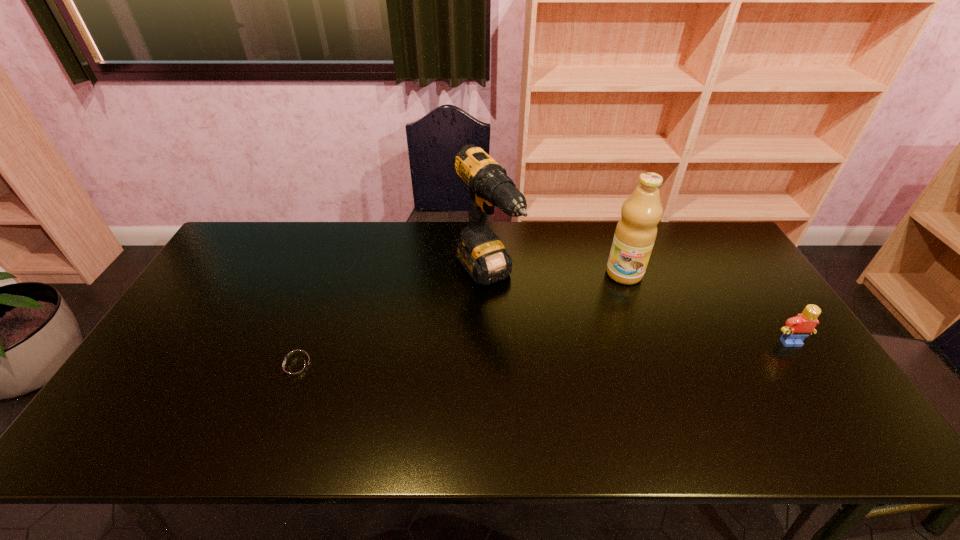
Find the location of a particular element. This screenshot has width=960, height=540. vacant spot on the desktop that is between the shortest object and the rightmost object and is positioned at the tip of the drill is located at coordinates (558, 354).

Where is `vacant space on the desktop that is between the leftmost object and the Lego and is positioned on the label of the olive oil`? This screenshot has width=960, height=540. vacant space on the desktop that is between the leftmost object and the Lego and is positioned on the label of the olive oil is located at coordinates (611, 352).